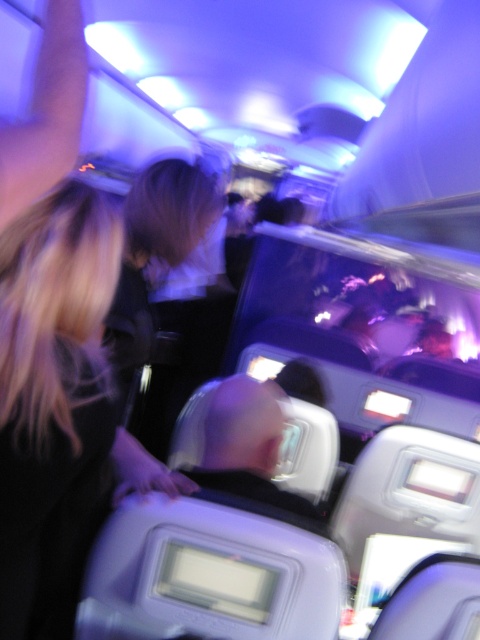
Question: Does blonde hair at left have a larger size compared to smooth skin head at center?

Choices:
 (A) no
 (B) yes

Answer: (B)

Question: Can you confirm if blonde hair at left is wider than smooth skin head at center?

Choices:
 (A) yes
 (B) no

Answer: (B)

Question: Does blonde hair at left appear on the right side of smooth skin head at center?

Choices:
 (A) no
 (B) yes

Answer: (A)